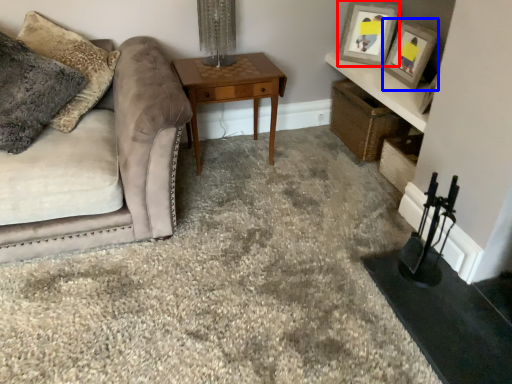
Question: Which object appears closest to the camera in this image, picture frame (highlighted by a red box) or picture frame (highlighted by a blue box)?

Choices:
 (A) picture frame
 (B) picture frame

Answer: (B)